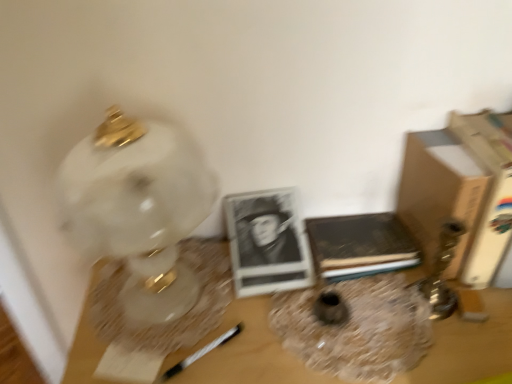
Where is `vacant position to the left of matte glass vase at center, which ranks as the 1th vase in left-to-right order`? vacant position to the left of matte glass vase at center, which ranks as the 1th vase in left-to-right order is located at coordinates (239, 311).